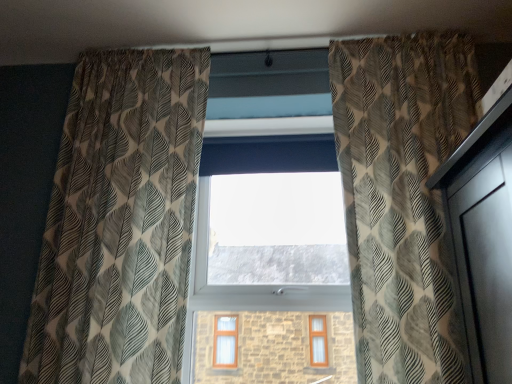
Question: Is transparent glass window at center further to the viewer compared to textured beige curtain at left, which is the second curtain from right to left?

Choices:
 (A) no
 (B) yes

Answer: (B)

Question: Is transparent glass window at center bigger than textured beige curtain at left, which is the first curtain in left-to-right order?

Choices:
 (A) yes
 (B) no

Answer: (B)

Question: Is transparent glass window at center far from textured beige curtain at left, which is the second curtain from right to left?

Choices:
 (A) yes
 (B) no

Answer: (B)

Question: Is transparent glass window at center outside textured beige curtain at left, which is the second curtain from right to left?

Choices:
 (A) no
 (B) yes

Answer: (B)

Question: Is transparent glass window at center smaller than textured beige curtain at left, which is the second curtain from right to left?

Choices:
 (A) no
 (B) yes

Answer: (B)

Question: Choose the correct answer: Is printed fabric curtain at right, placed as the 1th curtain when sorted from right to left, inside textured beige curtain at left, which is the first curtain in left-to-right order, or outside it?

Choices:
 (A) outside
 (B) inside

Answer: (A)

Question: From the image's perspective, is printed fabric curtain at right, the 2th curtain positioned from the left, above or below textured beige curtain at left, which is the first curtain in left-to-right order?

Choices:
 (A) below
 (B) above

Answer: (B)

Question: From a real-world perspective, is printed fabric curtain at right, placed as the 1th curtain when sorted from right to left, positioned above or below textured beige curtain at left, which is the second curtain from right to left?

Choices:
 (A) above
 (B) below

Answer: (A)

Question: Is printed fabric curtain at right, placed as the 1th curtain when sorted from right to left, to the left or to the right of textured beige curtain at left, which is the second curtain from right to left, in the image?

Choices:
 (A) right
 (B) left

Answer: (A)

Question: Is transparent glass window at center inside or outside of printed fabric curtain at right, placed as the 1th curtain when sorted from right to left?

Choices:
 (A) outside
 (B) inside

Answer: (A)

Question: Considering the positions of transparent glass window at center and printed fabric curtain at right, placed as the 1th curtain when sorted from right to left, in the image, is transparent glass window at center wider or thinner than printed fabric curtain at right, placed as the 1th curtain when sorted from right to left,?

Choices:
 (A) wide
 (B) thin

Answer: (B)

Question: In the image, is transparent glass window at center positioned in front of or behind printed fabric curtain at right, the 2th curtain positioned from the left?

Choices:
 (A) front
 (B) behind

Answer: (B)

Question: Visually, is transparent glass window at center positioned to the left or to the right of printed fabric curtain at right, the 2th curtain positioned from the left?

Choices:
 (A) left
 (B) right

Answer: (A)

Question: Would you say transparent glass window at center is to the left or to the right of textured beige curtain at left, which is the first curtain in left-to-right order, in the picture?

Choices:
 (A) left
 (B) right

Answer: (B)

Question: Is point (243, 180) positioned closer to the camera than point (92, 372)?

Choices:
 (A) farther
 (B) closer

Answer: (A)